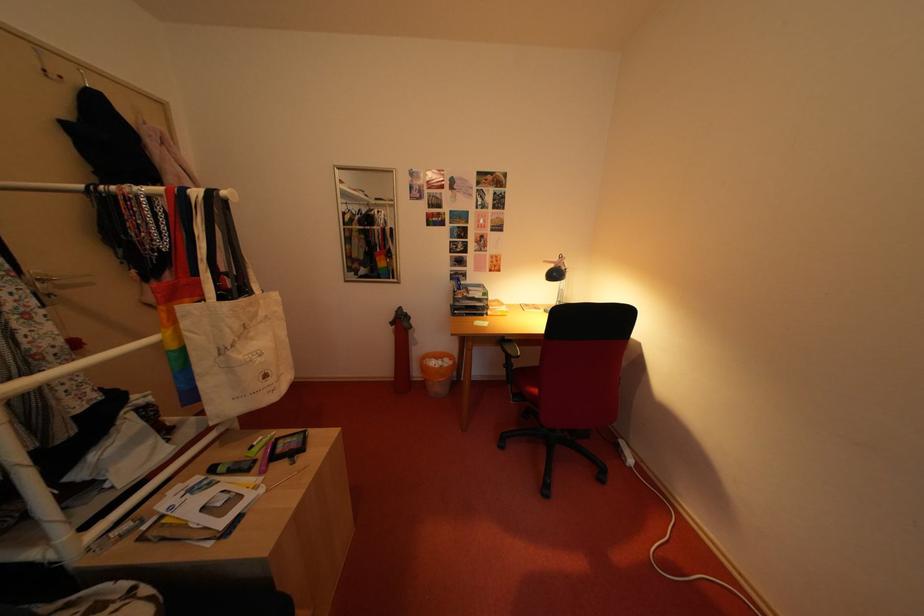
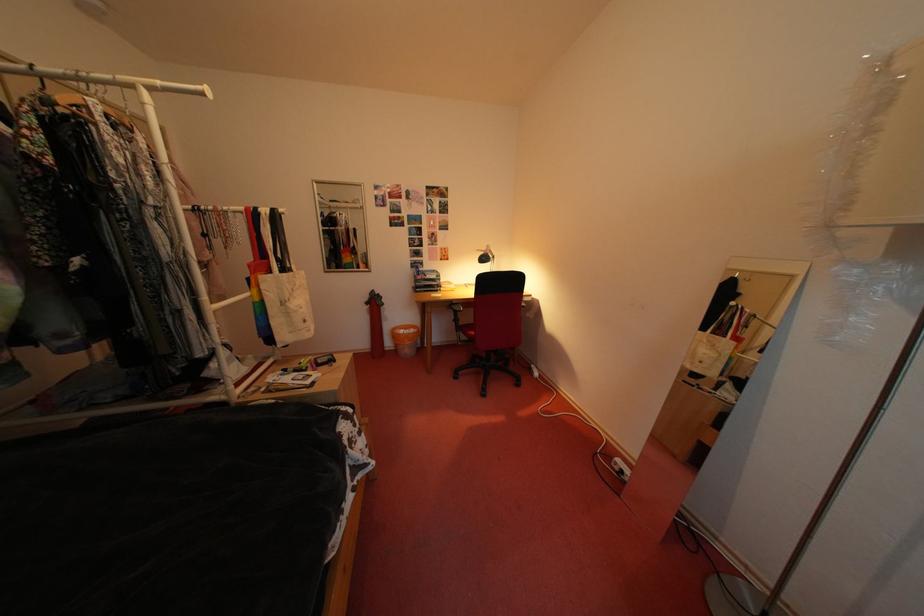
Where in the second image is the point corresponding to the point at 563,270 from the first image?

(492, 257)